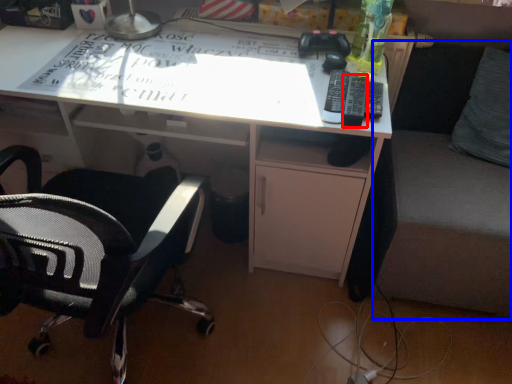
Question: Which point is closer to the camera, remote (highlighted by a red box) or couch (highlighted by a blue box)?

Choices:
 (A) remote
 (B) couch

Answer: (B)